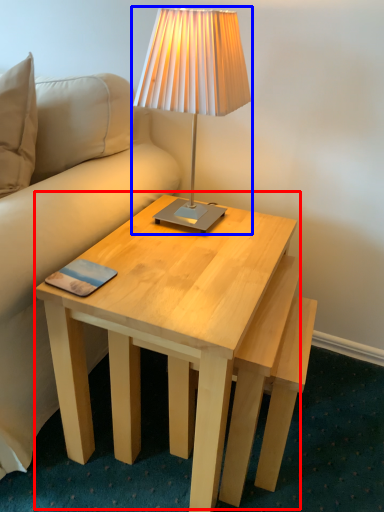
Question: Which object appears farthest to the camera in this image, coffee table (highlighted by a red box) or lamp (highlighted by a blue box)?

Choices:
 (A) coffee table
 (B) lamp

Answer: (B)